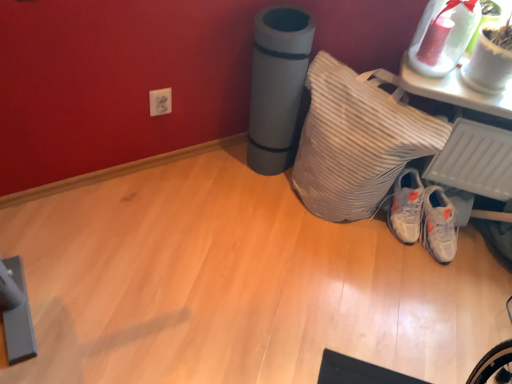
Question: In the image, is white matte sneakers at lower right positioned in front of or behind white glossy vase at upper right?

Choices:
 (A) behind
 (B) front

Answer: (A)

Question: Is white matte sneakers at lower right taller or shorter than white glossy vase at upper right?

Choices:
 (A) short
 (B) tall

Answer: (B)

Question: Based on their relative distances, which object is farther from the white glossy vase at upper right?

Choices:
 (A) white matte sneakers at lower right
 (B) white striped pillow at lower right

Answer: (A)

Question: Based on their relative distances, which object is nearer to the white glossy vase at upper right?

Choices:
 (A) white striped pillow at lower right
 (B) white matte sneakers at lower right

Answer: (A)